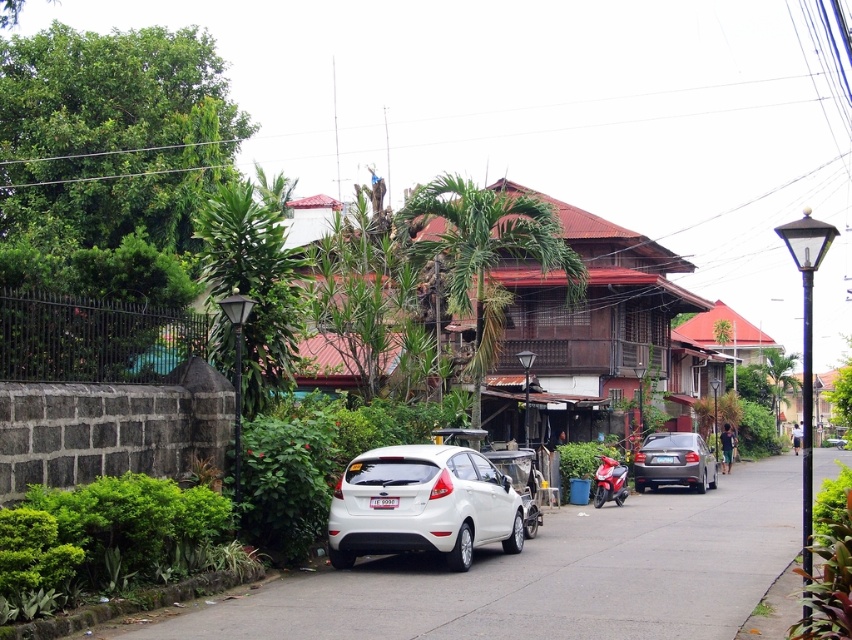
Is white asphalt pavement at lower center closer to the viewer compared to white matte hatchback at center?

Yes, white asphalt pavement at lower center is in front of white matte hatchback at center.

Image resolution: width=852 pixels, height=640 pixels. What do you see at coordinates (547, 577) in the screenshot?
I see `white asphalt pavement at lower center` at bounding box center [547, 577].

What are the coordinates of `white asphalt pavement at lower center` in the screenshot? It's located at (547, 577).

Find the location of a particular element. The width and height of the screenshot is (852, 640). white matte hatchback at center is located at coordinates (422, 504).

Which is in front, point (340, 525) or point (684, 449)?

Point (340, 525)

Does point (461, 513) lie behind point (658, 435)?

That is False.

Image resolution: width=852 pixels, height=640 pixels. Find the location of `white matte hatchback at center`. white matte hatchback at center is located at coordinates (422, 504).

Does white asphalt pavement at lower center have a larger size compared to satin silver sedan at center-right?

Correct, white asphalt pavement at lower center is larger in size than satin silver sedan at center-right.

Does white asphalt pavement at lower center have a lesser height compared to satin silver sedan at center-right?

Incorrect, white asphalt pavement at lower center's height does not fall short of satin silver sedan at center-right's.

Between point (709, 573) and point (683, 433), which one is positioned behind?

The point (683, 433) is more distant.

Where is `white asphalt pavement at lower center`? white asphalt pavement at lower center is located at coordinates (547, 577).